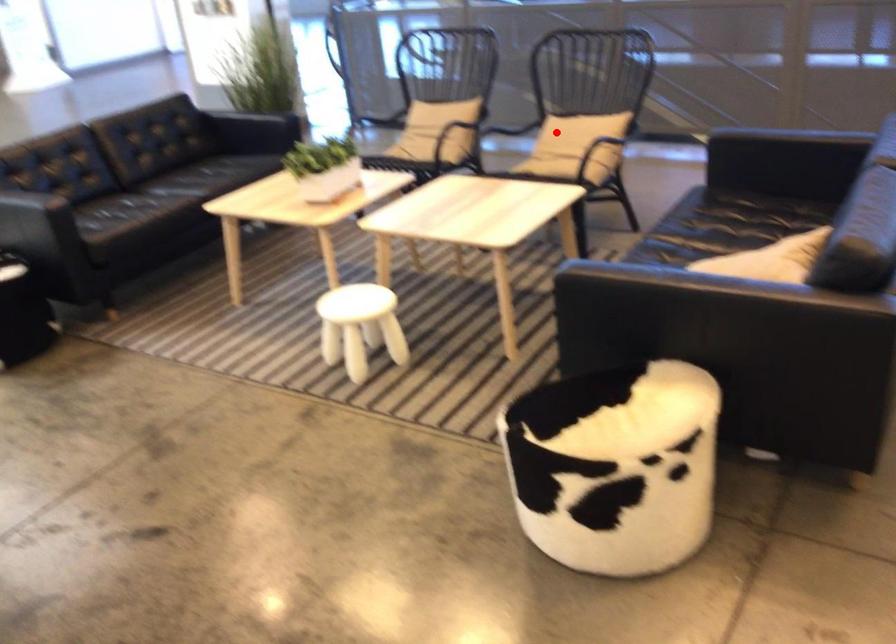
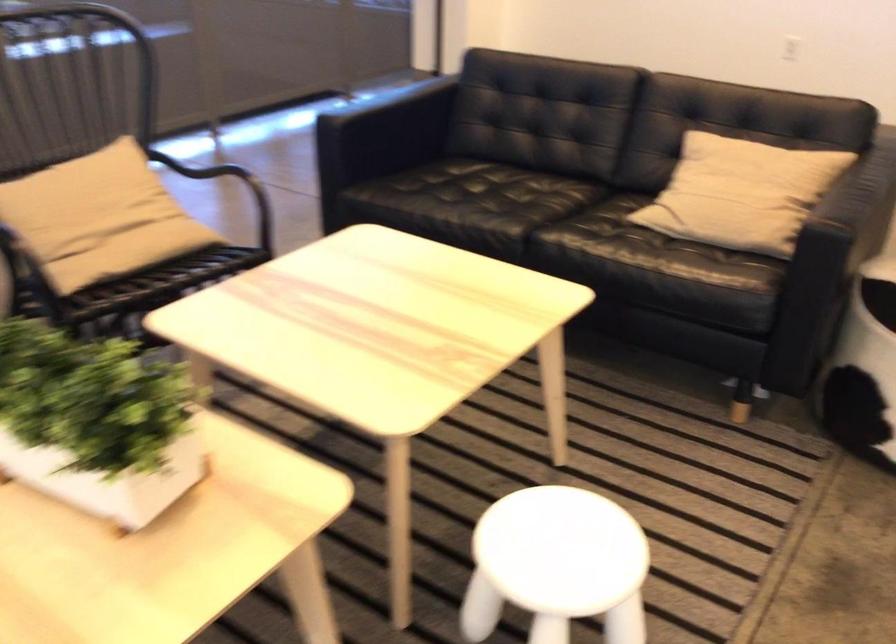
Question: A red point is marked in image1. In image2, is the corresponding 3D point closer to the camera or farther? Reply with the corresponding letter.

Choices:
 (A) The corresponding 3D point is closer.
 (B) The corresponding 3D point is farther.

Answer: (A)